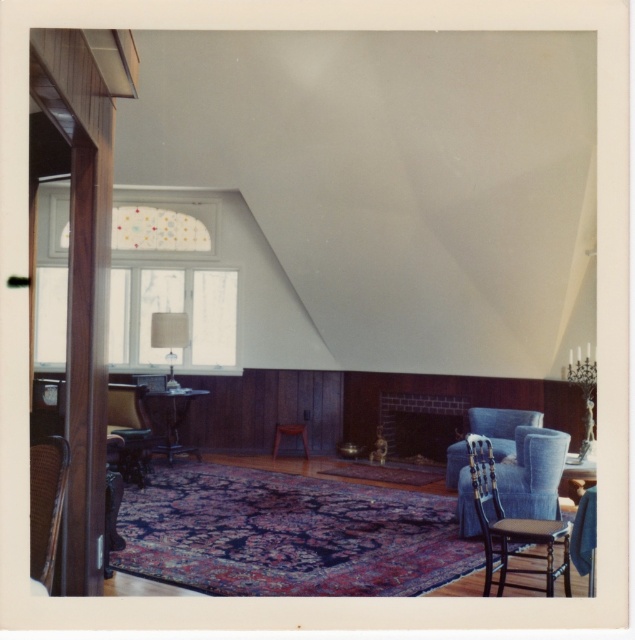
Question: Which is farther from the wooden chair at left?

Choices:
 (A) wooden side table at center
 (B) brick fireplace at center
 (C) white fabric lampshade at center
 (D) wooden chair at lower left

Answer: (B)

Question: Does brick fireplace at center appear on the right side of velvet blue armchair at center?

Choices:
 (A) yes
 (B) no

Answer: (B)

Question: Is wooden chair at lower right to the left of wooden side table at center from the viewer's perspective?

Choices:
 (A) no
 (B) yes

Answer: (A)

Question: Does brick fireplace at center appear on the right side of wooden chair at lower left?

Choices:
 (A) yes
 (B) no

Answer: (A)

Question: Which point is closer to the camera taking this photo?

Choices:
 (A) (36, 454)
 (B) (131, 419)
 (C) (491, 476)
 (D) (448, 404)

Answer: (A)

Question: Which of the following is the farthest from the observer?

Choices:
 (A) (509, 570)
 (B) (121, 401)
 (C) (384, 433)

Answer: (C)